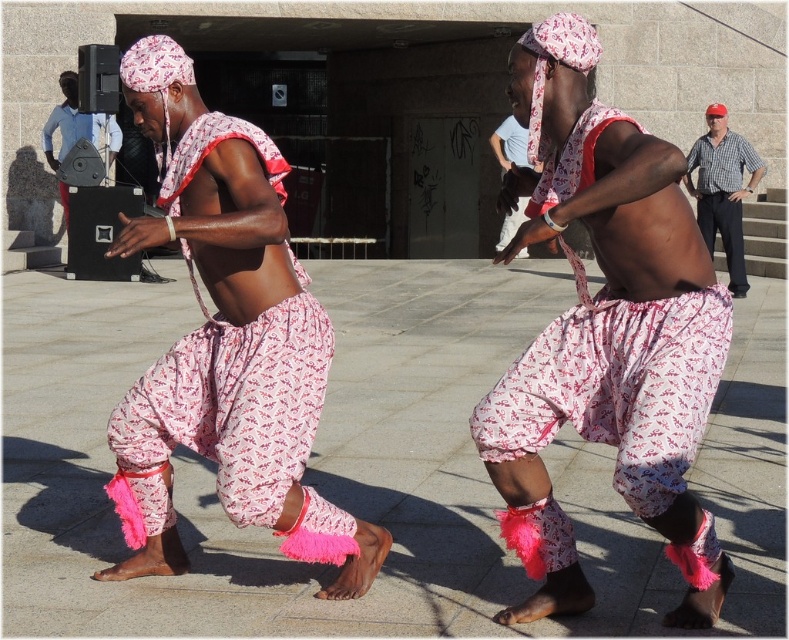
What object is located at the coordinates point (x=604, y=332) in the image?

The point (x=604, y=332) marks pink fabric pants at center.

You are a photographer positioned at the front of the scene. You want to take a photo that includes both the pink fabric pants at center and the light blue cotton shirt at upper center. Which object will appear larger in your photo?

The pink fabric pants at center will appear larger in the photo because it is closer to the viewer than the light blue cotton shirt at upper center.

You are a photographer trying to capture the dancer in the foreground. There is a checkered shirt at right that might block your view. Where is the point at coordinate (722, 189) located in relation to the checkered shirt at right?

The point at coordinate (722, 189) corresponds to the checkered shirt at right, so it is located exactly at that position.